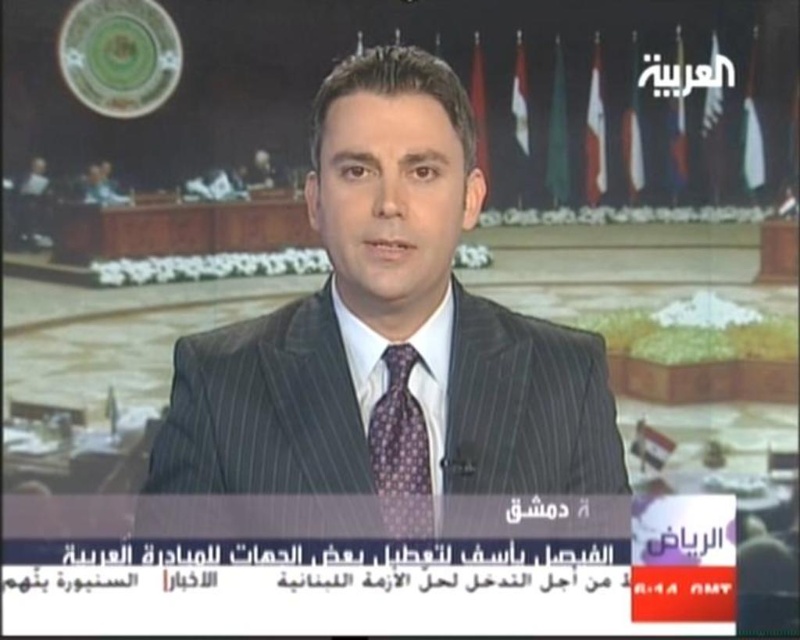
Question: Which of the following is the closest to the observer?

Choices:
 (A) (312, 218)
 (B) (385, 458)

Answer: (B)

Question: Does dark gray pinstripe suit at center have a smaller size compared to purple dotted tie at center?

Choices:
 (A) yes
 (B) no

Answer: (B)

Question: Does dark gray pinstripe suit at center appear over purple dotted tie at center?

Choices:
 (A) no
 (B) yes

Answer: (B)

Question: Among these points, which one is farthest from the camera?

Choices:
 (A) (350, 140)
 (B) (374, 477)

Answer: (B)

Question: Does dark gray pinstripe suit at center have a larger size compared to purple dotted tie at center?

Choices:
 (A) yes
 (B) no

Answer: (A)